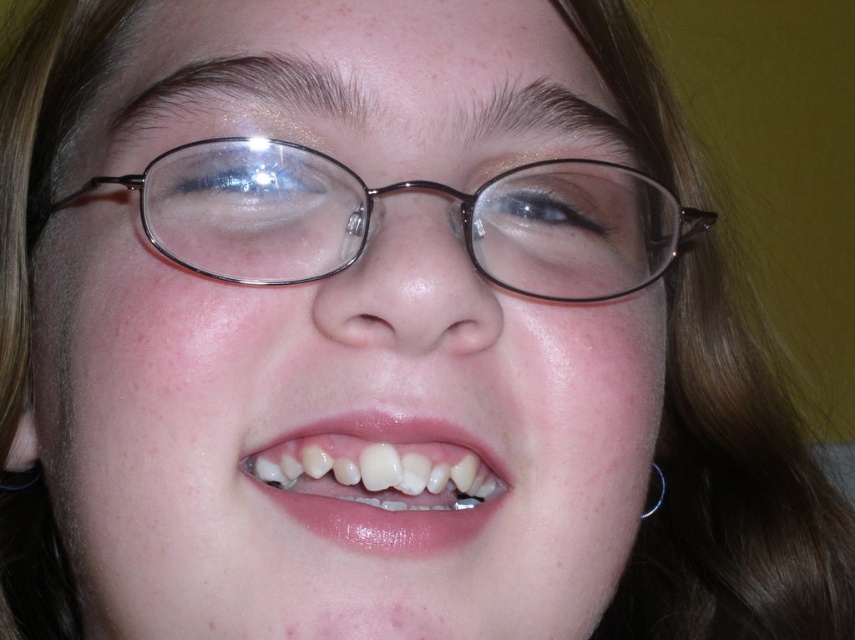
Which is more to the right, metallic frame glasses at center or translucent plastic teeth at center?

metallic frame glasses at center is more to the right.

Which of these two, metallic frame glasses at center or translucent plastic teeth at center, stands taller?

metallic frame glasses at center

Who is more forward, (x=148, y=205) or (x=405, y=452)?

Point (x=405, y=452) is in front.

You are a GUI agent. You are given a task and a screenshot of the screen. Output one action in this format:
    pyautogui.click(x=<x>, y=<y>)
    Task: Click on the metallic frame glasses at center
    This screenshot has width=855, height=640.
    Given the screenshot: What is the action you would take?
    pyautogui.click(x=404, y=193)